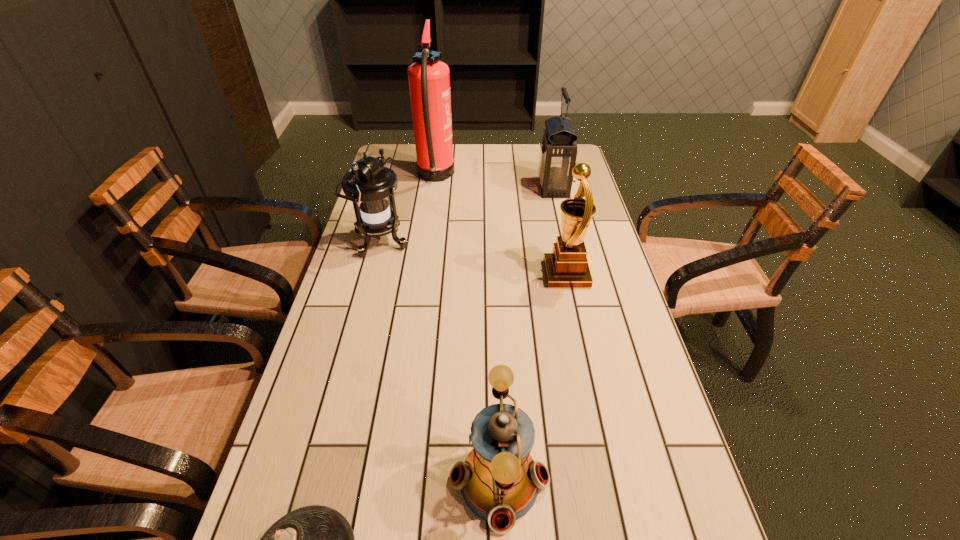
Where is `the tallest object`? This screenshot has height=540, width=960. the tallest object is located at coordinates (429, 78).

The image size is (960, 540). I want to click on award, so click(x=566, y=267).

Image resolution: width=960 pixels, height=540 pixels. Find the location of `the rightmost lantern`. the rightmost lantern is located at coordinates (558, 151).

Identify the location of the leftmost lantern. The width and height of the screenshot is (960, 540). (369, 185).

The width and height of the screenshot is (960, 540). I want to click on the shortest lantern, so click(x=499, y=480).

Where is `the second lantern from left to right`? This screenshot has height=540, width=960. the second lantern from left to right is located at coordinates (499, 480).

Find the location of a particular element. blank space located 0.200m at the nozzle of the tallest object is located at coordinates (506, 177).

The image size is (960, 540). In order to click on vacant space located on the front-facing side of the award in this screenshot , I will do `click(423, 274)`.

Where is `vacant space located 0.280m on the front-facing side of the award`? vacant space located 0.280m on the front-facing side of the award is located at coordinates (450, 274).

Find the location of a particular element. This screenshot has width=960, height=540. vacant space located 0.400m on the front-facing side of the award is located at coordinates (410, 274).